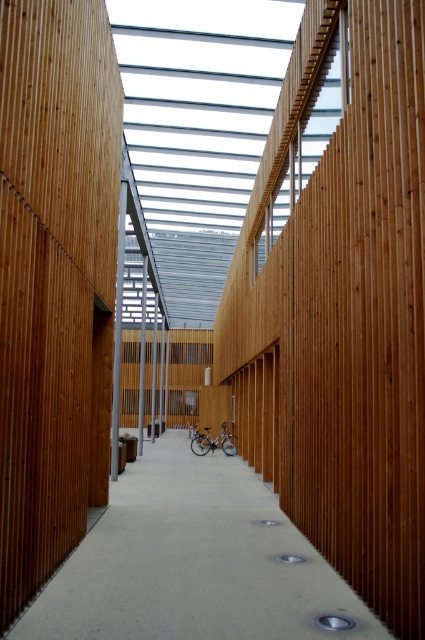
Question: Does concrete at center appear on the right side of silver metallic bicycle at center?

Choices:
 (A) yes
 (B) no

Answer: (B)

Question: Which object appears farthest from the camera in this image?

Choices:
 (A) concrete at center
 (B) natural wood pillar at center
 (C) silver metallic bicycle at center

Answer: (C)

Question: In this image, where is natural wood pillar at center located relative to silver metallic bicycle at center?

Choices:
 (A) below
 (B) above

Answer: (B)

Question: Is natural wood pillar at center wider than silver metallic bicycle at center?

Choices:
 (A) no
 (B) yes

Answer: (A)

Question: Which object appears closest to the camera in this image?

Choices:
 (A) concrete at center
 (B) silver metallic bicycle at center

Answer: (A)

Question: Considering the real-world distances, which object is farthest from the silver metallic bicycle at center?

Choices:
 (A) concrete at center
 (B) natural wood pillar at center

Answer: (B)